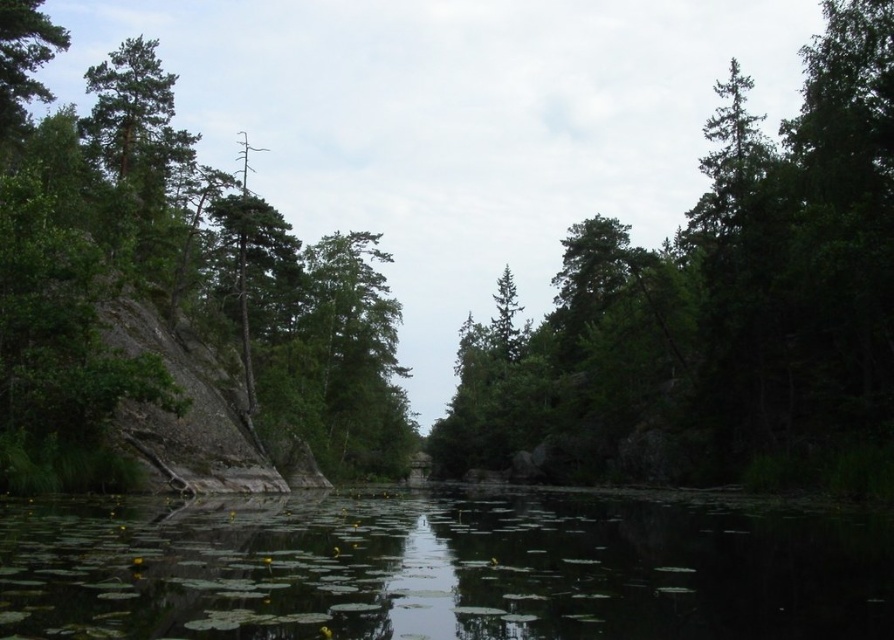
You are standing on a path near the green leafy tree at center and the green leafy river at center. If you want to cross the river, can you step onto the tree to reach the other side?

The green leafy tree at center is positioned over the green leafy river at center, so you can step onto the tree to cross the river and reach the other side.

Based on the photo, you are standing at the center of the rocky cliffs and want to locate the green leafy tree at center. According to the coordinates provided, in which direction should you look to find it?

The green leafy tree at center is located at coordinates point (714,301), which means it is positioned slightly to the left and lower from the exact center of the scene. Since you are standing at the center of the rocky cliffs, you should look slightly to your left and downward to locate it.

You are a hiker who wants to take a photo of both the green leafy tree at center and the green rough rock at left. Since you have a limited field of view, which object should you focus on to ensure both are in the frame?

You should focus on the green rough rock at left because it is shorter than the green leafy tree at center, allowing both to fit within your camera frame.